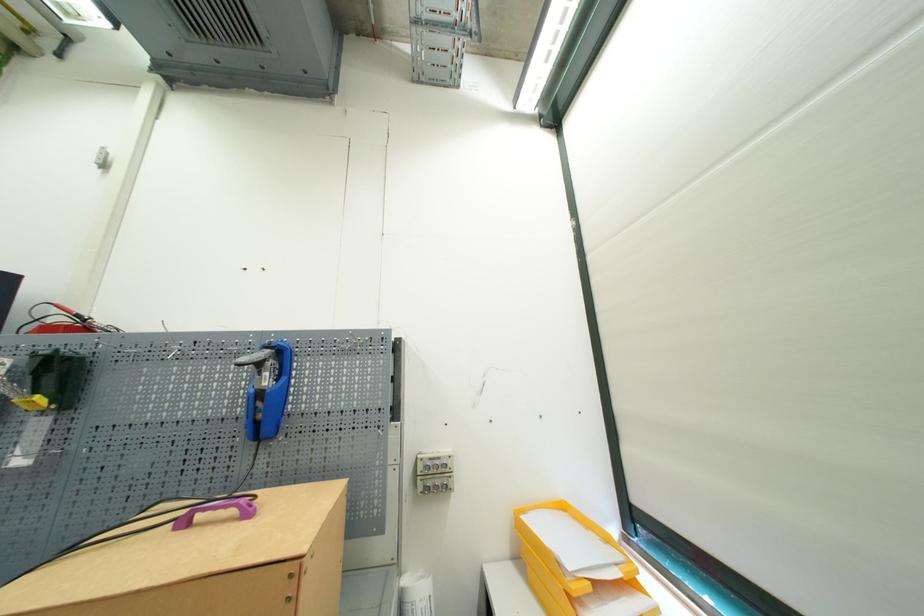
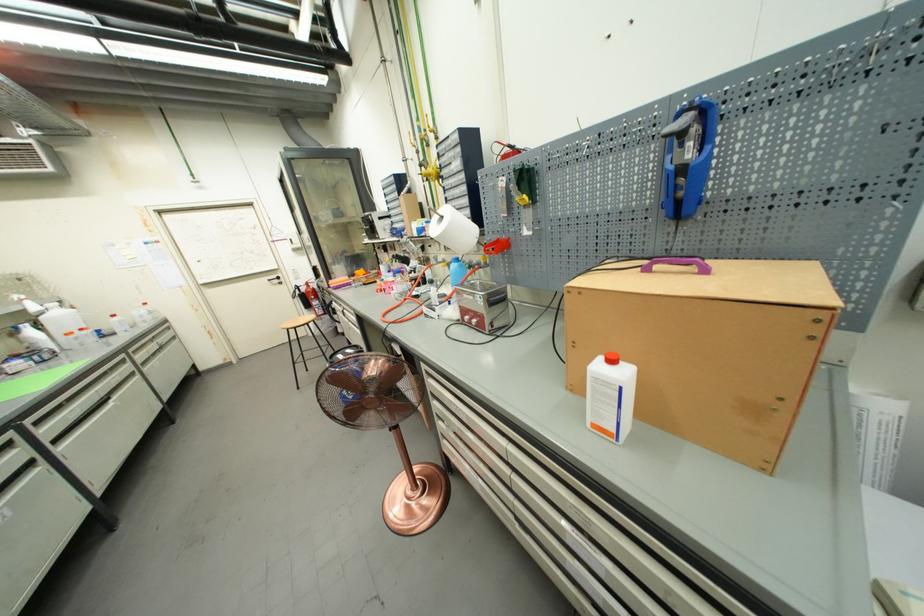
Find the pixel in the second image that matches point (56, 405) in the first image.

(535, 201)